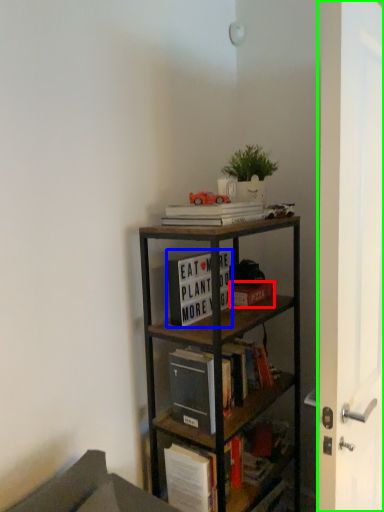
Question: Based on their relative distances, which object is nearer to book (highlighted by a red box)? Choose from book (highlighted by a blue box) and glass door (highlighted by a green box).

Choices:
 (A) book
 (B) glass door

Answer: (A)